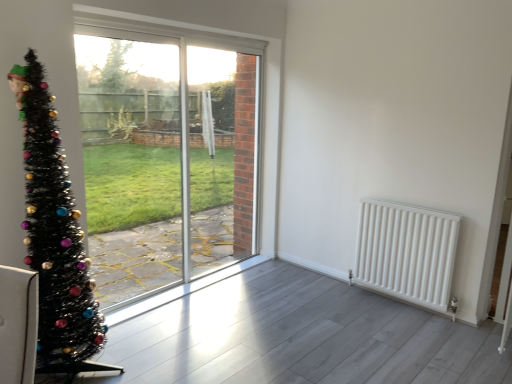
Find the location of a particular element. free space that is in between black tinsel christmas tree at left and transparent glass window at center is located at coordinates (172, 312).